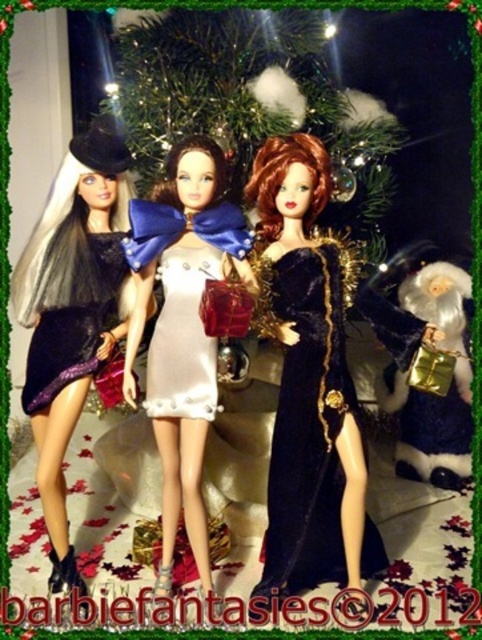
Question: Is velvet gold santa at center below pearlized satin dress at center?

Choices:
 (A) yes
 (B) no

Answer: (A)

Question: Can you confirm if velvet gold santa at center is thinner than shiny purple fabric dress at left?

Choices:
 (A) yes
 (B) no

Answer: (B)

Question: Does green textured wreath at upper center appear on the right side of pearlized satin dress at center?

Choices:
 (A) no
 (B) yes

Answer: (B)

Question: Which point is closer to the camera?

Choices:
 (A) shiny purple fabric dress at left
 (B) shiny black dress at left
 (C) pearlized satin dress at center

Answer: (B)

Question: Estimate the real-world distances between objects in this image. Which object is closer to the velvet gold santa at center?

Choices:
 (A) shiny purple fabric dress at left
 (B) shiny black dress at left
 (C) green textured wreath at upper center
 (D) velvet black dress at center

Answer: (D)

Question: Which of the following is the closest to the observer?

Choices:
 (A) velvet gold santa at center
 (B) pearlized satin dress at center
 (C) green textured wreath at upper center

Answer: (B)